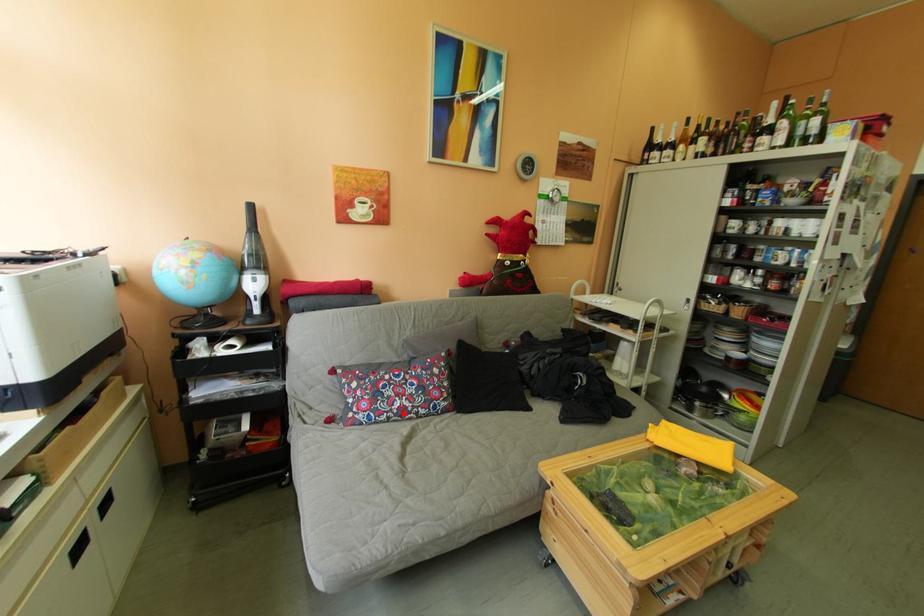
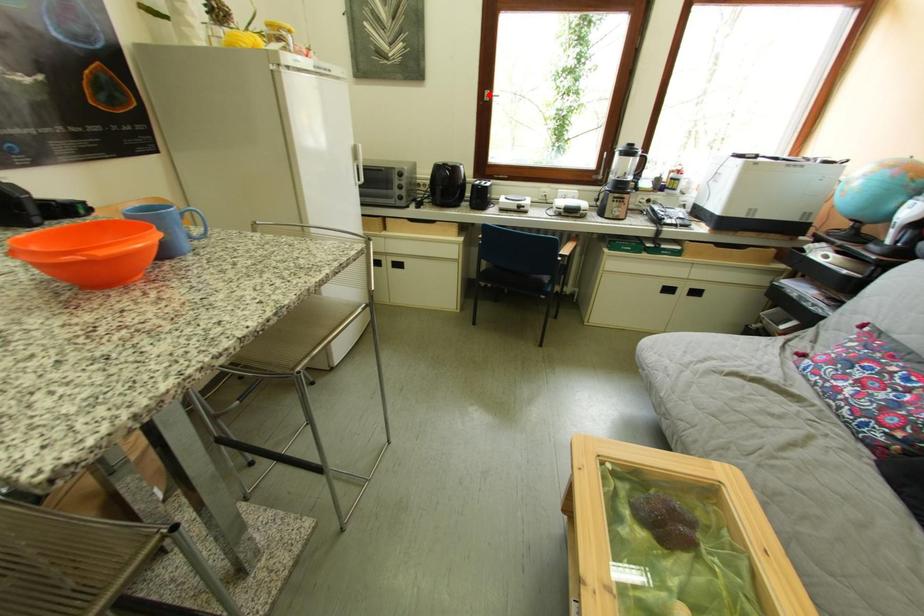
I am providing you with two images of the same scene from different viewpoints. A red point is marked on the first image and another point is marked on the second image. Is the red point in image1 aligned with the point shown in image2?

No